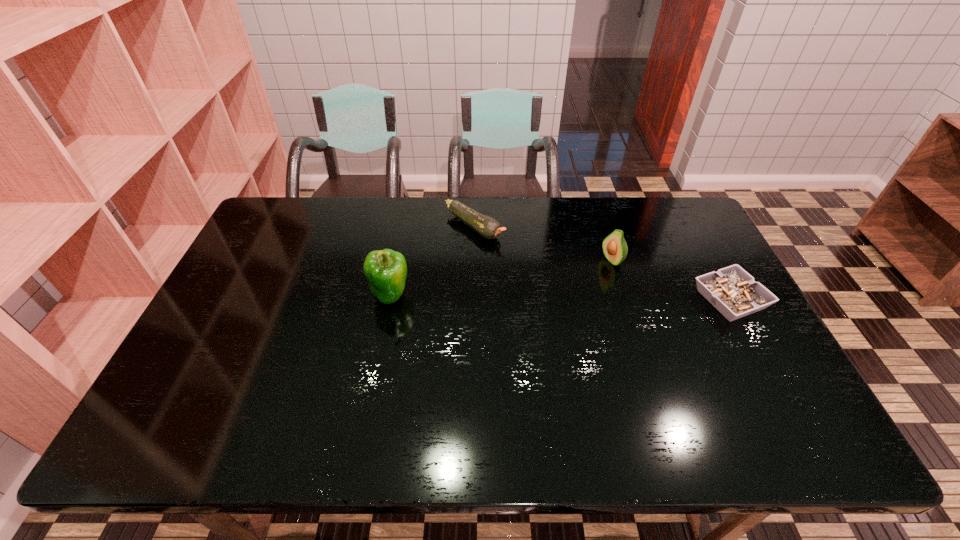
What are the coordinates of `free space on the desktop that is between the bell pepper and the ashtray and is positioned on the cut side of the third object from left to right` in the screenshot? It's located at (529, 297).

Identify the location of free spot on the desktop that is between the leftmost object and the shortest object and is positioned at the blossom end of the zucchini. This screenshot has height=540, width=960. (573, 298).